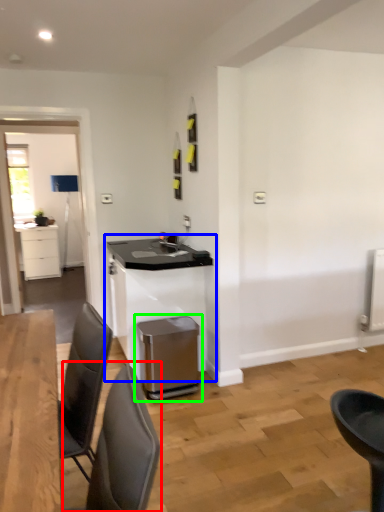
Question: Considering the real-world distances, which object is closest to chair (highlighted by a red box)? table (highlighted by a blue box) or waste container (highlighted by a green box).

Choices:
 (A) table
 (B) waste container

Answer: (B)